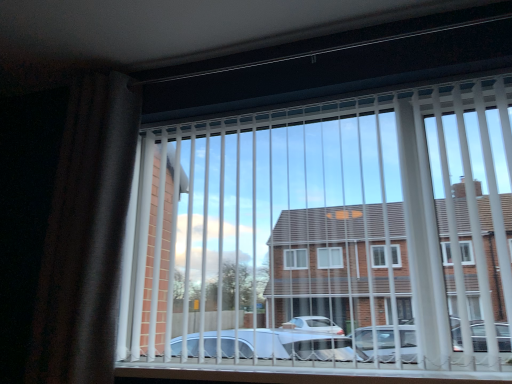
Question: Is white plastic blinds at center inside the boundaries of dark fabric curtain at left, or outside?

Choices:
 (A) inside
 (B) outside

Answer: (B)

Question: Is white plastic blinds at center in front of or behind dark fabric curtain at left in the image?

Choices:
 (A) behind
 (B) front

Answer: (B)

Question: Considering the positions of white plastic blinds at center and dark fabric curtain at left in the image, is white plastic blinds at center taller or shorter than dark fabric curtain at left?

Choices:
 (A) short
 (B) tall

Answer: (A)

Question: From the image's perspective, relative to white plastic blinds at center, is dark fabric curtain at left above or below?

Choices:
 (A) above
 (B) below

Answer: (A)

Question: Considering the positions of dark fabric curtain at left and white plastic blinds at center in the image, is dark fabric curtain at left taller or shorter than white plastic blinds at center?

Choices:
 (A) tall
 (B) short

Answer: (A)

Question: Would you say dark fabric curtain at left is to the left or to the right of white plastic blinds at center in the picture?

Choices:
 (A) right
 (B) left

Answer: (B)

Question: Choose the correct answer: Is dark fabric curtain at left inside white plastic blinds at center or outside it?

Choices:
 (A) inside
 (B) outside

Answer: (B)